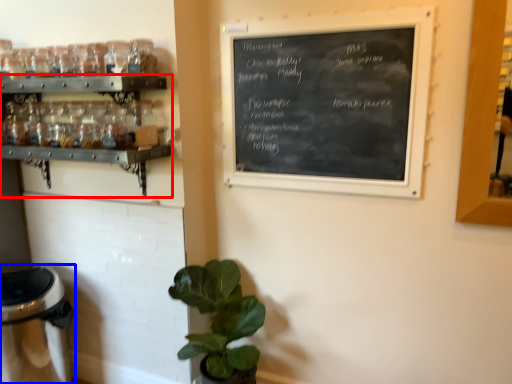
Question: Which object appears closest to the camera in this image, shelf (highlighted by a red box) or appliance (highlighted by a blue box)?

Choices:
 (A) shelf
 (B) appliance

Answer: (A)